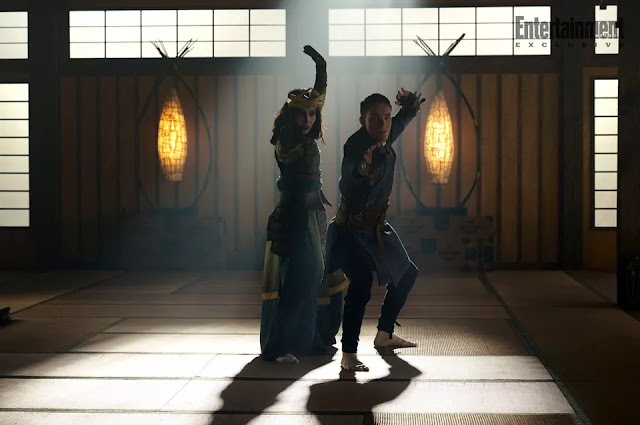
At what (x,y) coordinates should I click in order to perform the action: click on paper windows. Please return your answer as a coordinate pair (x, y). Image resolution: width=640 pixels, height=425 pixels. Looking at the image, I should click on (11, 155), (13, 40), (148, 27), (422, 25), (610, 46), (611, 145).